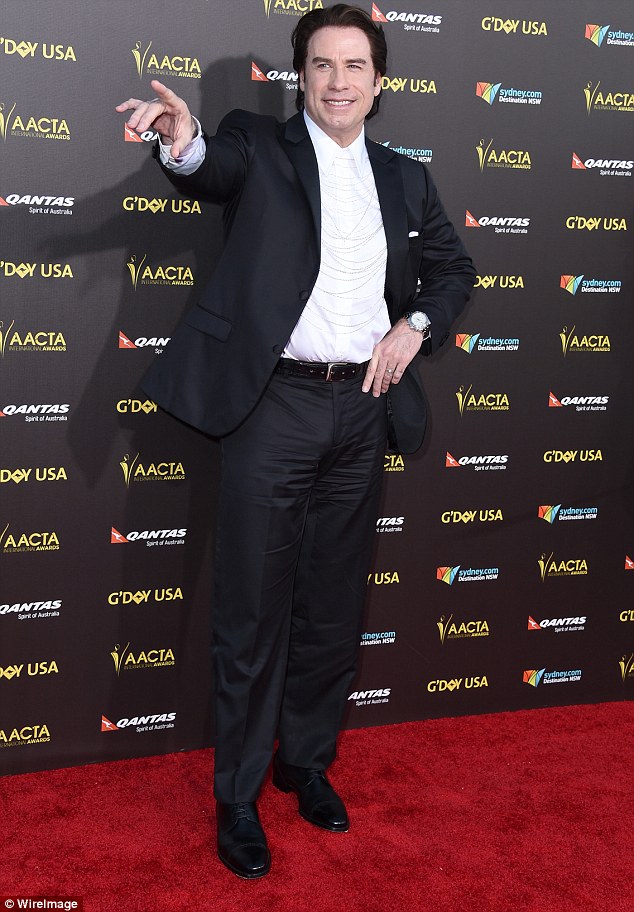
Locate an element on the screen. This screenshot has height=912, width=634. red carpeting is located at coordinates (550, 782).